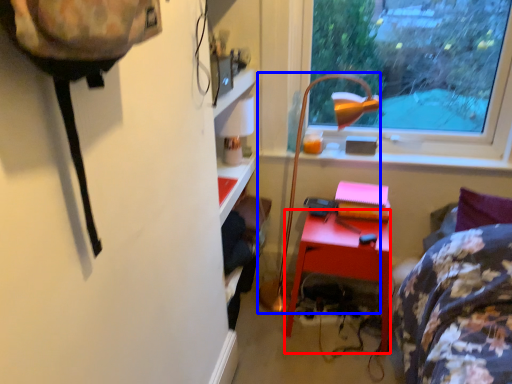
Question: Among these objects, which one is nearest to the camera, desk (highlighted by a red box) or lamp (highlighted by a blue box)?

Choices:
 (A) desk
 (B) lamp

Answer: (B)